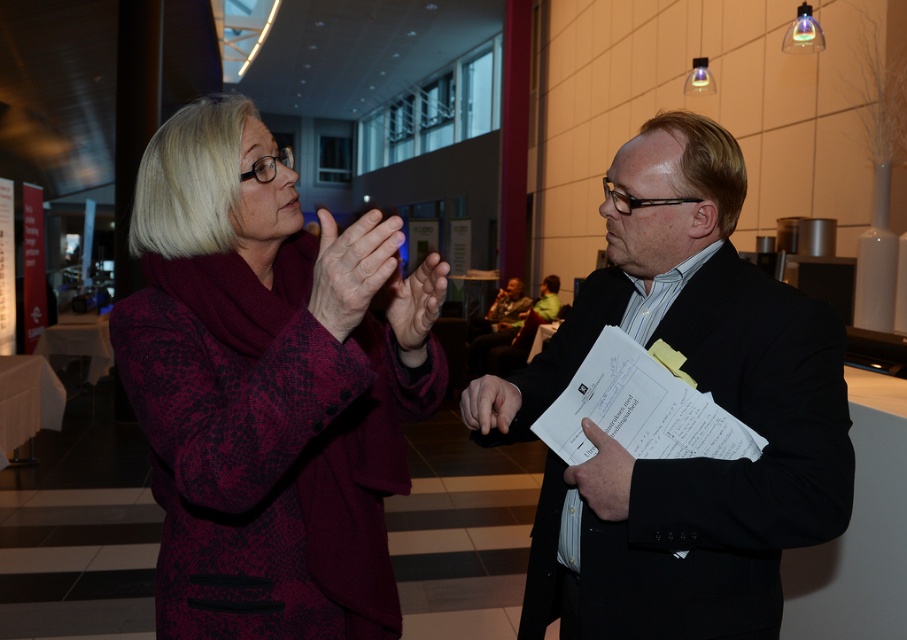
Between maroon textured coat at center and black matte suit at center, which one appears on the right side from the viewer's perspective?

From the viewer's perspective, black matte suit at center appears more on the right side.

Does maroon textured coat at center appear over black matte suit at center?

Correct, maroon textured coat at center is located above black matte suit at center.

Locate an element on the screen. The image size is (907, 640). maroon textured coat at center is located at coordinates (266, 388).